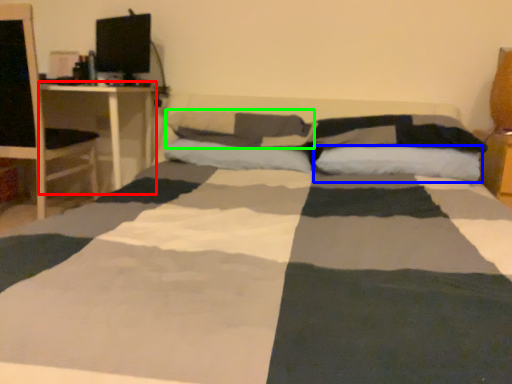
Question: Which is farther away from desk (highlighted by a red box)? pillow (highlighted by a blue box) or pillow (highlighted by a green box)?

Choices:
 (A) pillow
 (B) pillow

Answer: (A)